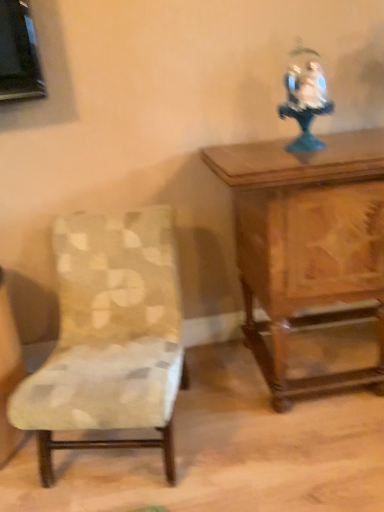
Question: From their relative heights in the image, would you say patterned fabric chair at left is taller or shorter than wooden carved table at upper right?

Choices:
 (A) short
 (B) tall

Answer: (A)

Question: From a real-world perspective, is patterned fabric chair at left positioned above or below wooden carved table at upper right?

Choices:
 (A) below
 (B) above

Answer: (A)

Question: Considering the real-world distances, which object is closest to the patterned fabric chair at left?

Choices:
 (A) wooden carved table at upper right
 (B) white porcelain figurine at upper right

Answer: (A)

Question: Based on their relative distances, which object is farther from the patterned fabric chair at left?

Choices:
 (A) white porcelain figurine at upper right
 (B) wooden carved table at upper right

Answer: (A)